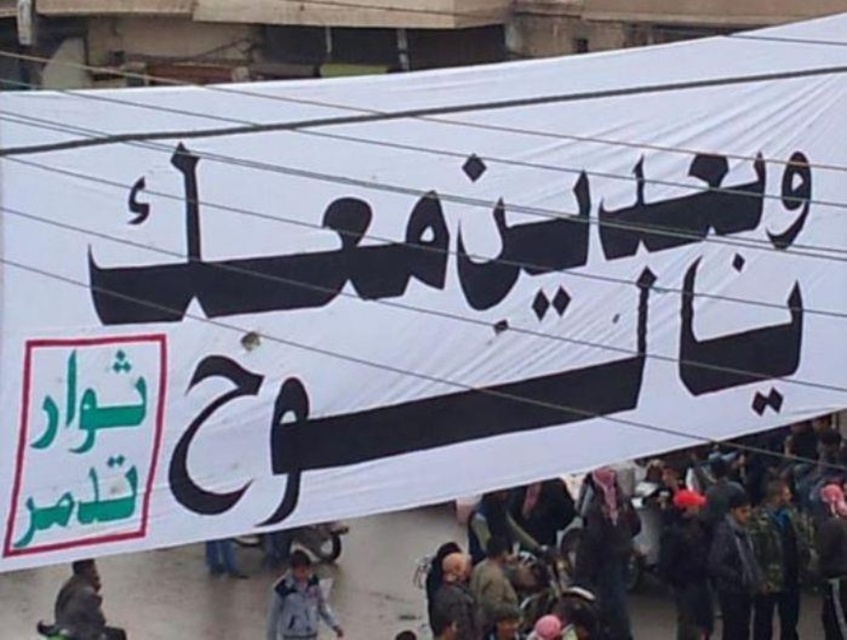
Question: Which object is positioned farthest from the white fleece jacket at center?

Choices:
 (A) dark gray clothing at lower right
 (B) brown leather jacket at lower left

Answer: (A)

Question: Is dark gray clothing at lower right thinner than brown leather jacket at lower left?

Choices:
 (A) yes
 (B) no

Answer: (A)

Question: Can you confirm if dark gray clothing at lower right is smaller than white fleece jacket at center?

Choices:
 (A) yes
 (B) no

Answer: (A)

Question: Does dark gray clothing at lower right have a larger size compared to brown leather jacket at lower left?

Choices:
 (A) no
 (B) yes

Answer: (A)

Question: Which of the following is the closest to the observer?

Choices:
 (A) (313, 600)
 (B) (117, 630)

Answer: (B)

Question: Among these objects, which one is nearest to the camera?

Choices:
 (A) brown leather jacket at lower left
 (B) dark gray clothing at lower right
 (C) white fleece jacket at center

Answer: (A)